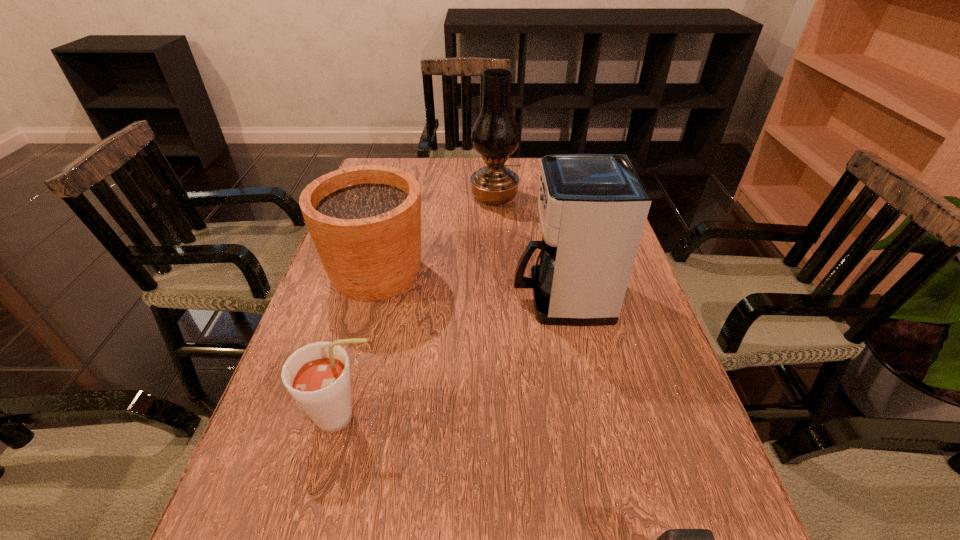
The height and width of the screenshot is (540, 960). I want to click on vacant space located on the drink side of the fourth farthest object, so click(x=462, y=417).

Identify the location of object situated at the far edge. The image size is (960, 540). (495, 135).

What are the coordinates of `flowerpot situated at the left edge` in the screenshot? It's located at (365, 221).

You are a GUI agent. You are given a task and a screenshot of the screen. Output one action in this format:
    pyautogui.click(x=<x>, y=<y>)
    Task: Click on the root beer that is positioned at the left edge
    
    Given the screenshot: What is the action you would take?
    pyautogui.click(x=317, y=375)

You are a GUI agent. You are given a task and a screenshot of the screen. Output one action in this format:
    pyautogui.click(x=<x>, y=<y>)
    Task: Click on the object that is at the right edge
    The image size is (960, 540).
    Given the screenshot: What is the action you would take?
    pyautogui.click(x=593, y=208)

The width and height of the screenshot is (960, 540). In the image, there is a desktop. In order to click on vacant space at the far edge in this screenshot , I will do `click(464, 167)`.

Where is `vacant space at the left edge`? The image size is (960, 540). vacant space at the left edge is located at coordinates (313, 436).

What are the coordinates of `vacant space at the right edge of the desktop` in the screenshot? It's located at (595, 379).

This screenshot has width=960, height=540. Find the location of `vacant space in between the coffee maker and the third shortest object`. vacant space in between the coffee maker and the third shortest object is located at coordinates (468, 286).

Where is `blank region between the coffee maker and the flowerpot`? This screenshot has width=960, height=540. blank region between the coffee maker and the flowerpot is located at coordinates (468, 286).